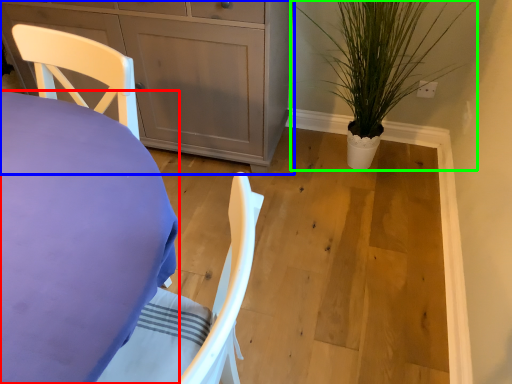
Question: Which is farther away from desk (highlighted by a red box)? cabinetry (highlighted by a blue box) or houseplant (highlighted by a green box)?

Choices:
 (A) cabinetry
 (B) houseplant

Answer: (B)